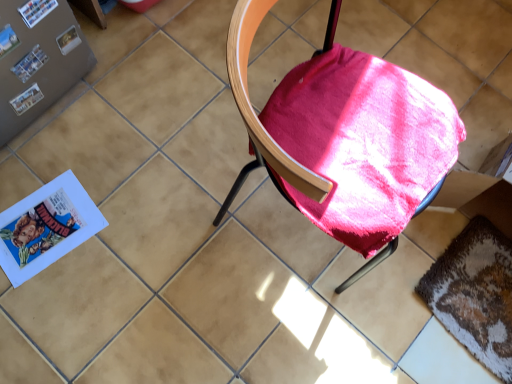
This screenshot has height=384, width=512. Find the location of `vacant space underneath textured brown mat at lower right (from a real-world perspective)`. vacant space underneath textured brown mat at lower right (from a real-world perspective) is located at coordinates (478, 308).